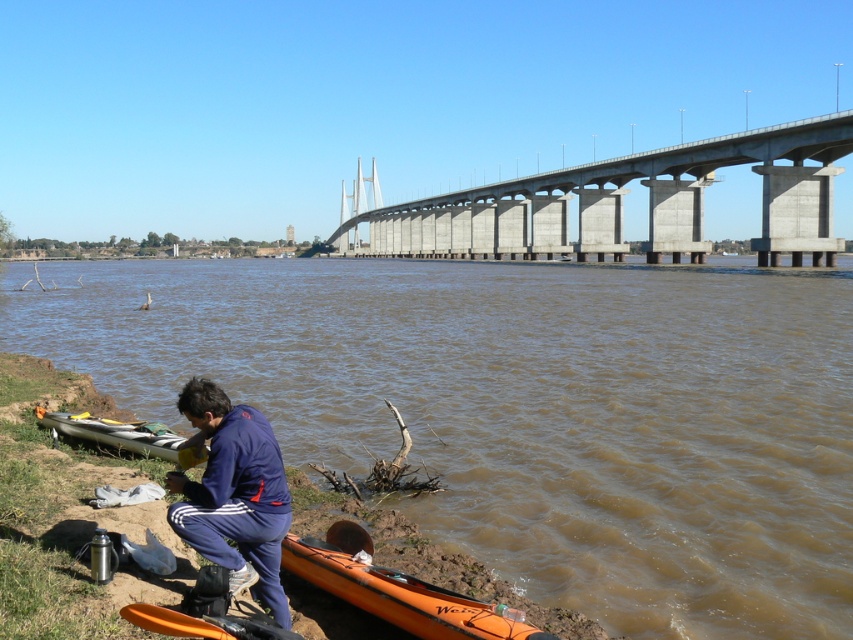
Question: Can you confirm if brown muddy water at lower center is positioned to the left of concrete bridge at upper center?

Choices:
 (A) yes
 (B) no

Answer: (A)

Question: Based on their relative distances, which object is nearer to the orange plastic kayak at lower center?

Choices:
 (A) concrete bridge at upper center
 (B) blue fabric pants at lower center
 (C) gray matte canoe at lower left

Answer: (B)

Question: Which object is positioned closest to the brown muddy water at lower center?

Choices:
 (A) orange plastic kayak at lower center
 (B) blue fabric pants at lower center
 (C) concrete bridge at upper center
 (D) gray matte canoe at lower left

Answer: (A)

Question: Does brown muddy water at lower center lie in front of orange plastic kayak at lower center?

Choices:
 (A) yes
 (B) no

Answer: (B)

Question: In this image, where is brown muddy water at lower center located relative to blue fabric pants at lower center?

Choices:
 (A) left
 (B) right

Answer: (A)

Question: Which of these objects is positioned closest to the blue fabric pants at lower center?

Choices:
 (A) orange plastic kayak at lower center
 (B) concrete bridge at upper center
 (C) gray matte canoe at lower left

Answer: (A)